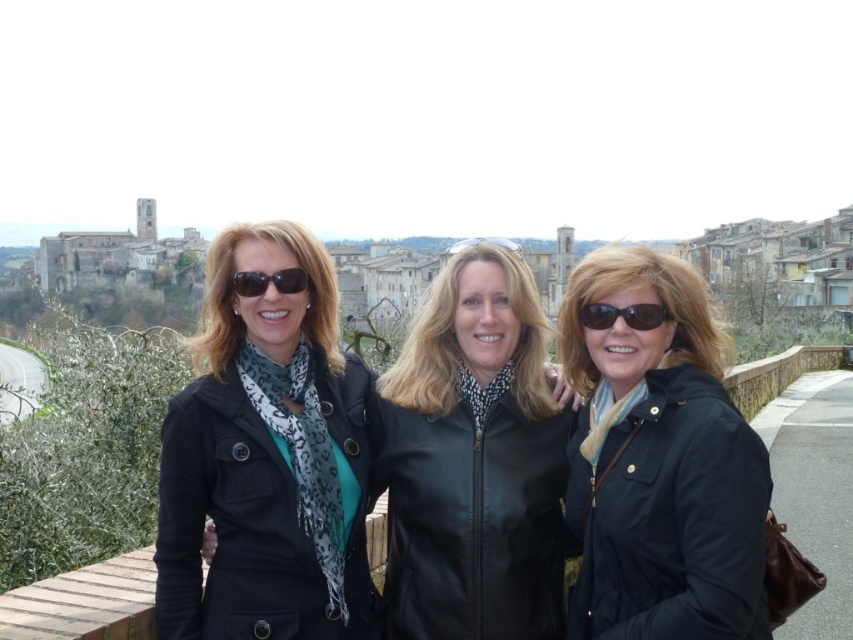
You are a fashion designer observing the scene. You notice two items of clothing at the center of the image. Which one is taller between the matte black coat at center and the black leather jacket at center?

The matte black coat at center is taller than the black leather jacket at center according to the description.